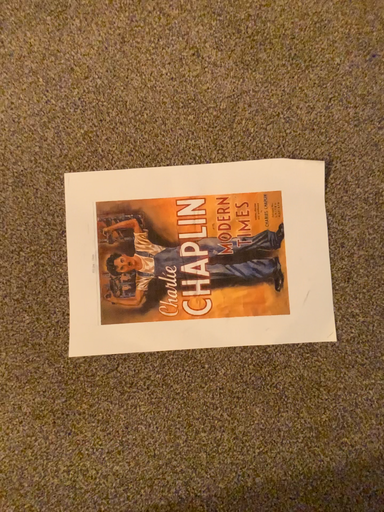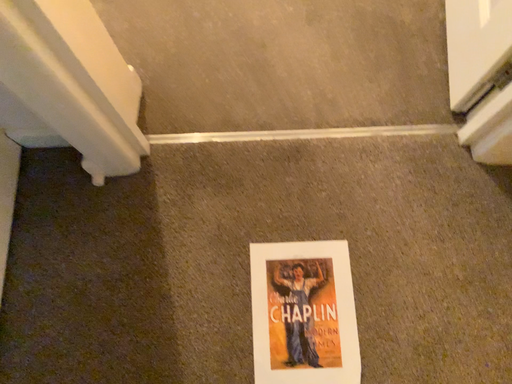
Question: How did the camera likely rotate when shooting the video?

Choices:
 (A) rotated upward
 (B) rotated downward

Answer: (A)